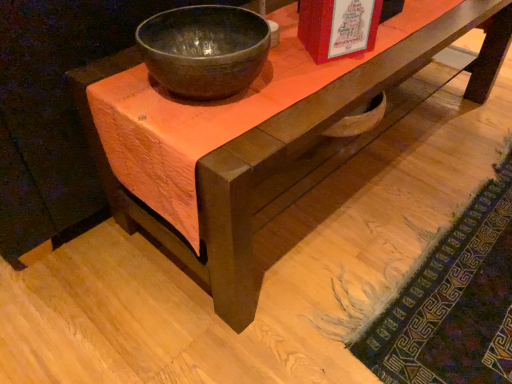
Question: In the image, is matte dark gray bowl at center positioned in front of or behind textured wool mat at lower right?

Choices:
 (A) behind
 (B) front

Answer: (B)

Question: From their relative heights in the image, would you say matte dark gray bowl at center is taller or shorter than textured wool mat at lower right?

Choices:
 (A) tall
 (B) short

Answer: (A)

Question: Estimate the real-world distances between objects in this image. Which object is closer to the matte dark gray bowl at center?

Choices:
 (A) textured wool mat at lower right
 (B) matte red book at upper center

Answer: (B)

Question: Which of these objects is positioned closest to the textured wool mat at lower right?

Choices:
 (A) matte red book at upper center
 (B) matte dark gray bowl at center

Answer: (A)